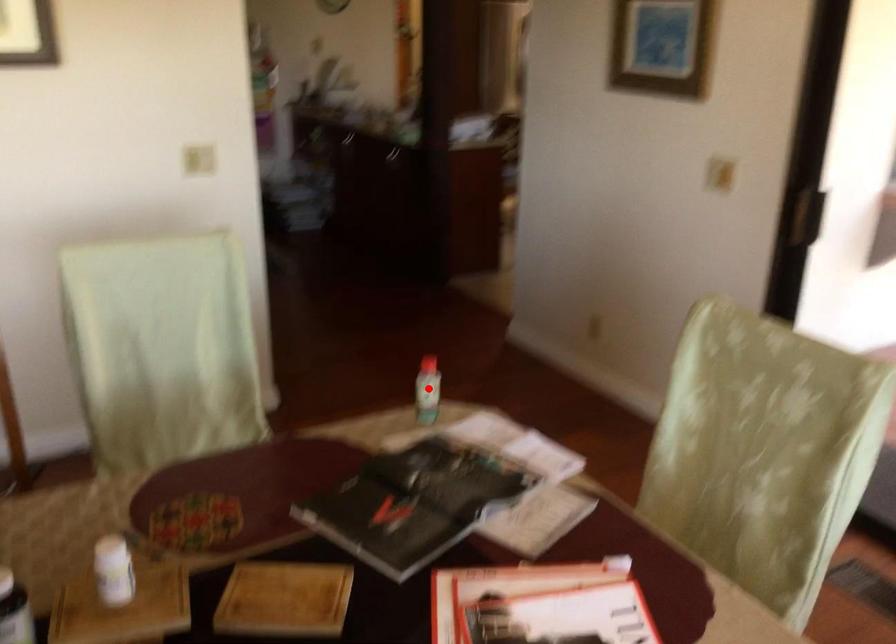
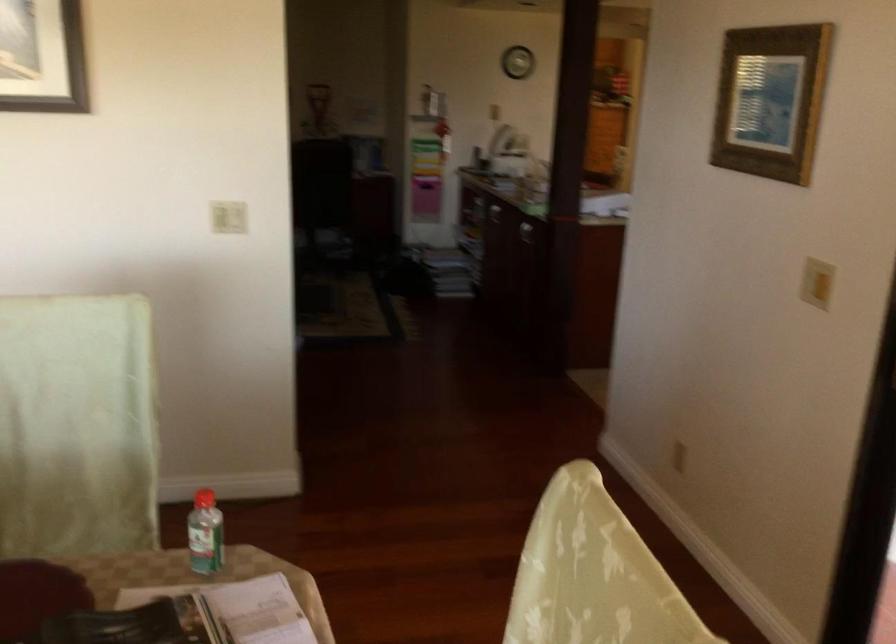
In the second image, find the point that corresponds to the highlighted location in the first image.

(204, 534)